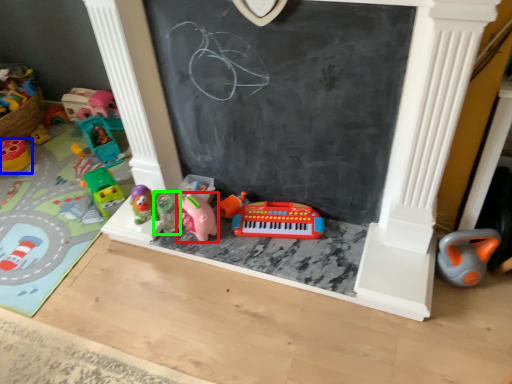
Question: Which is nearer to the toy (highlighted by a red box)? toy (highlighted by a blue box) or toy (highlighted by a green box).

Choices:
 (A) toy
 (B) toy

Answer: (B)